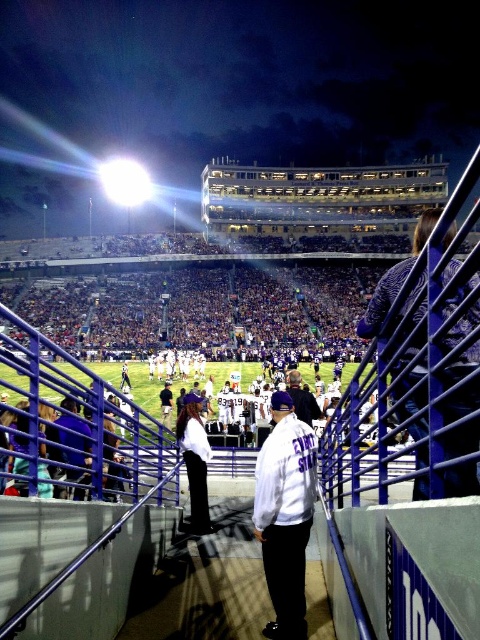
You are a photographer standing at the center of the stadium field. You want to take a photo of the patterned fabric jacket at right. Based on your position, is the jacket located to your left or right side?

The patterned fabric jacket at right is located to your right side since it is positioned at point [395,278], which places it to the right of the center.

You are a photographer at the stadium and want to capture a photo that includes both the patterned fabric jacket at right and the white matte jacket at center. Based on their positions, which jacket should you focus on first to ensure both are in the frame?

The patterned fabric jacket at right is positioned on the right side of the white matte jacket at center. To include both in the frame, focus on the white matte jacket at center first as it is centrally located, ensuring the patterned fabric jacket at right will be captured to its right side.